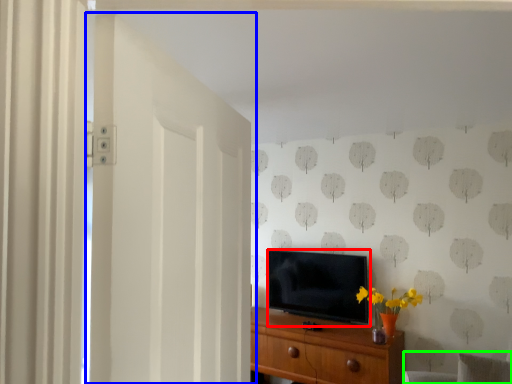
Question: Estimate the real-world distances between objects in this image. Which object is closer to television (highlighted by a red box), door (highlighted by a blue box) or swivel chair (highlighted by a green box)?

Choices:
 (A) door
 (B) swivel chair

Answer: (B)